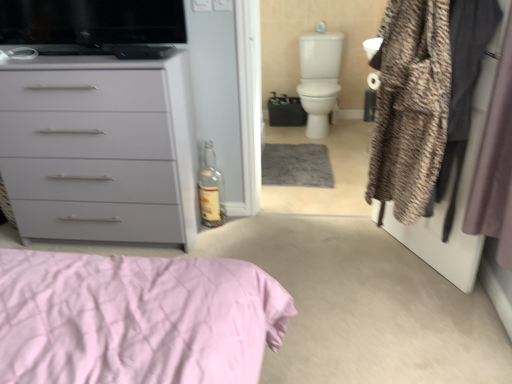
Where is `vacant space situated on the left part of fuzzy fabric coat at right`? The height and width of the screenshot is (384, 512). vacant space situated on the left part of fuzzy fabric coat at right is located at coordinates (346, 259).